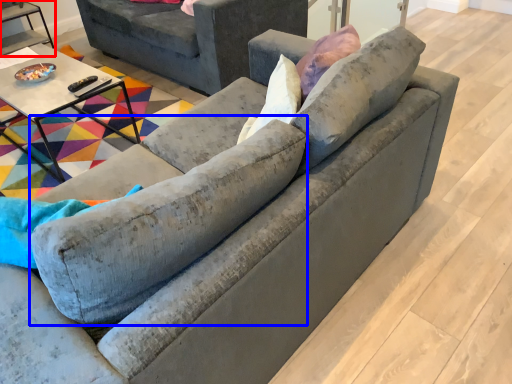
Question: Among these objects, which one is farthest to the camera, table (highlighted by a red box) or swivel chair (highlighted by a blue box)?

Choices:
 (A) table
 (B) swivel chair

Answer: (A)